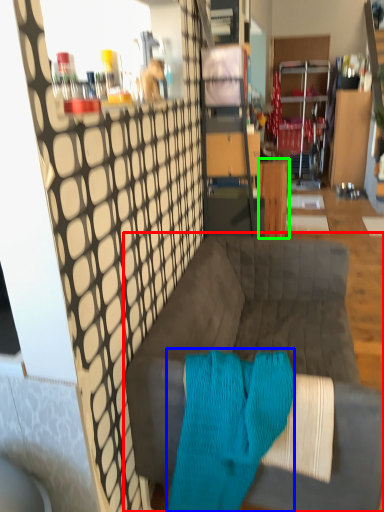
Question: Considering the real-world distances, which object is closest to studio couch (highlighted by a red box)? aqua (highlighted by a blue box) or table (highlighted by a green box).

Choices:
 (A) aqua
 (B) table

Answer: (A)